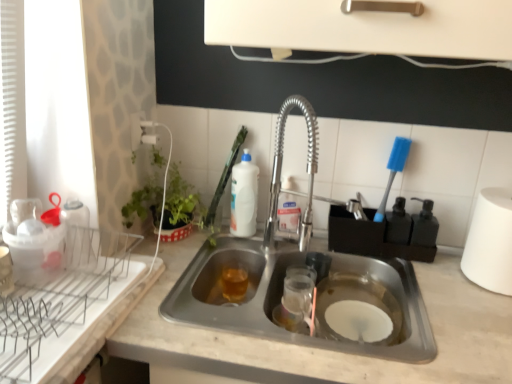
Question: Is white plastic brush at upper center looking in the opposite direction of white glossy bottle at upper center, arranged as the first beverage when viewed from the top?

Choices:
 (A) yes
 (B) no

Answer: (A)

Question: From the image's perspective, is white plastic brush at upper center under white glossy bottle at upper center, the second beverage positioned from the bottom?

Choices:
 (A) yes
 (B) no

Answer: (B)

Question: From a real-world perspective, does white plastic brush at upper center sit lower than white glossy bottle at upper center, arranged as the first beverage when viewed from the top?

Choices:
 (A) yes
 (B) no

Answer: (B)

Question: From a real-world perspective, is white plastic brush at upper center over white glossy bottle at upper center, the second beverage positioned from the bottom?

Choices:
 (A) no
 (B) yes

Answer: (B)

Question: Does white plastic brush at upper center come behind white glossy bottle at upper center, the second beverage positioned from the bottom?

Choices:
 (A) no
 (B) yes

Answer: (A)

Question: Is white plastic brush at upper center to the left of white glossy bottle at upper center, the second beverage positioned from the bottom, from the viewer's perspective?

Choices:
 (A) no
 (B) yes

Answer: (B)

Question: Considering the relative sizes of white matte paper towel at right and translucent amber liquid at sink bottom, the 1th beverage in the bottom-to-top sequence, in the image provided, is white matte paper towel at right smaller than translucent amber liquid at sink bottom, the 1th beverage in the bottom-to-top sequence,?

Choices:
 (A) no
 (B) yes

Answer: (A)

Question: Is translucent amber liquid at sink bottom, which ranks as the 2th beverage in top-to-bottom order, a part of white matte paper towel at right?

Choices:
 (A) yes
 (B) no

Answer: (B)

Question: Considering the relative sizes of white matte paper towel at right and translucent amber liquid at sink bottom, which ranks as the 2th beverage in top-to-bottom order, in the image provided, is white matte paper towel at right bigger than translucent amber liquid at sink bottom, which ranks as the 2th beverage in top-to-bottom order,?

Choices:
 (A) no
 (B) yes

Answer: (B)

Question: Is white matte paper towel at right taller than translucent amber liquid at sink bottom, which ranks as the 2th beverage in top-to-bottom order?

Choices:
 (A) yes
 (B) no

Answer: (A)

Question: Is white matte paper towel at right not near translucent amber liquid at sink bottom, the 1th beverage in the bottom-to-top sequence?

Choices:
 (A) no
 (B) yes

Answer: (A)

Question: From a real-world perspective, is white matte paper towel at right physically above translucent amber liquid at sink bottom, the 1th beverage in the bottom-to-top sequence?

Choices:
 (A) no
 (B) yes

Answer: (B)

Question: Can you confirm if white matte paper towel at right is shorter than white plastic brush at upper center?

Choices:
 (A) yes
 (B) no

Answer: (B)